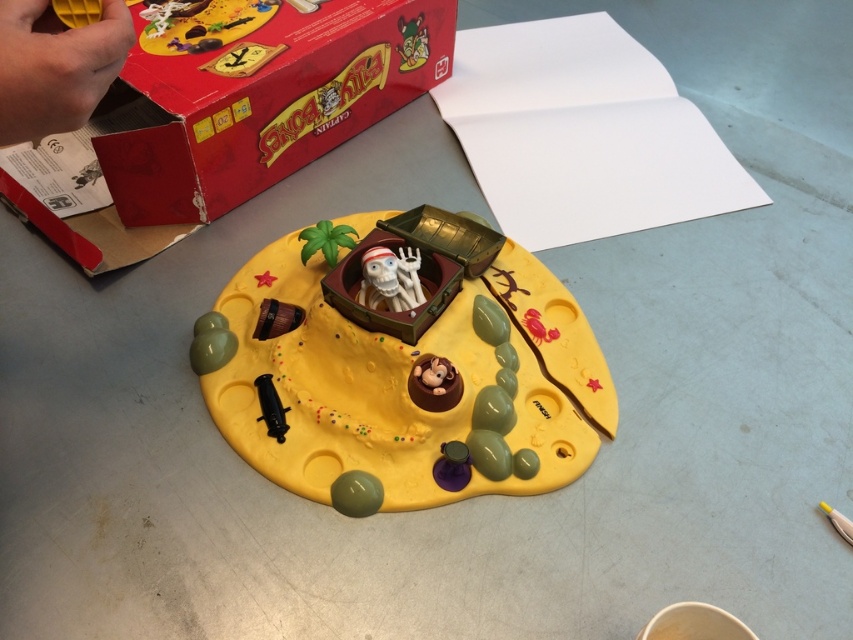
Which is more to the right, yellow matte pirate island at center or yellow matte hand at upper left?

Positioned to the right is yellow matte pirate island at center.

Is point (418, 312) positioned behind point (6, 12)?

Yes, point (418, 312) is farther from viewer.

At what (x,y) coordinates should I click in order to perform the action: click on yellow matte pirate island at center. Please return your answer as a coordinate pair (x, y). This screenshot has height=640, width=853. Looking at the image, I should click on (404, 372).

Is brown matte monkey at center above black plastic cannon at lower center?

Yes.

Is brown matte monkey at center shorter than black plastic cannon at lower center?

Indeed, brown matte monkey at center has a lesser height compared to black plastic cannon at lower center.

Is point (426, 401) farther from camera compared to point (262, 410)?

No.

Locate an element on the screen. The height and width of the screenshot is (640, 853). brown matte monkey at center is located at coordinates tap(434, 384).

From the picture: Is white matte skeleton at center wider than black plastic cannon at lower center?

Yes, white matte skeleton at center is wider than black plastic cannon at lower center.

Image resolution: width=853 pixels, height=640 pixels. What do you see at coordinates (390, 278) in the screenshot?
I see `white matte skeleton at center` at bounding box center [390, 278].

Identify the location of white matte skeleton at center. The width and height of the screenshot is (853, 640). (390, 278).